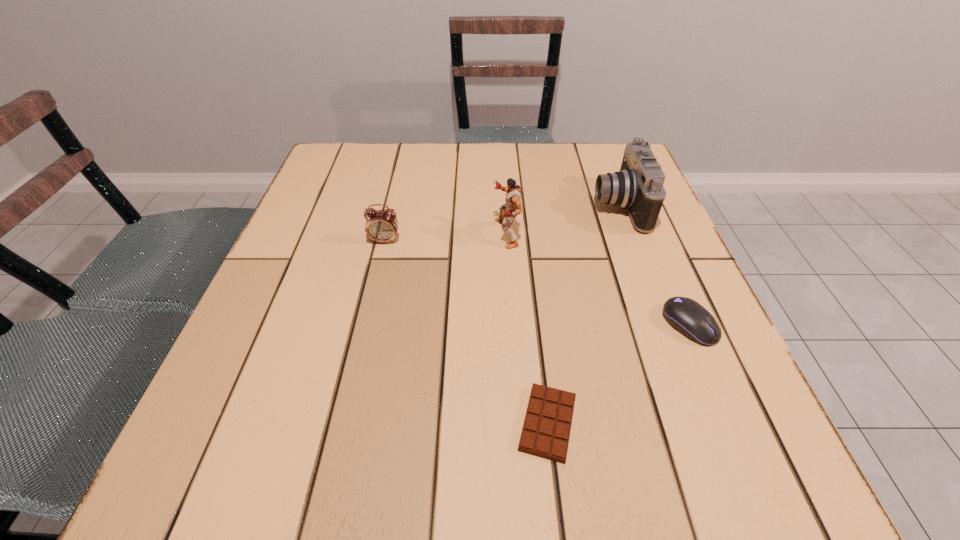
I want to click on puncher, so click(x=512, y=207).

Where is `camera`? Image resolution: width=960 pixels, height=540 pixels. camera is located at coordinates [638, 187].

Where is `alarm clock`? The height and width of the screenshot is (540, 960). alarm clock is located at coordinates (381, 225).

The image size is (960, 540). Find the location of `the third tallest object`. the third tallest object is located at coordinates click(381, 225).

You are a GUI agent. You are given a task and a screenshot of the screen. Output one action in this format:
    pyautogui.click(x=<x>, y=<y>)
    Task: Click on the fourth farthest object
    The height and width of the screenshot is (540, 960).
    Given the screenshot: What is the action you would take?
    pyautogui.click(x=688, y=317)

Locate an element on the screen. This screenshot has height=540, width=960. the second shortest object is located at coordinates (688, 317).

Locate an element on the screen. Image resolution: width=960 pixels, height=540 pixels. candy bar is located at coordinates (546, 430).

Where is `the nearest object`? the nearest object is located at coordinates (546, 430).

This screenshot has width=960, height=540. Find the location of `vacant area situated 0.190m on the front-facing side of the puncher`. vacant area situated 0.190m on the front-facing side of the puncher is located at coordinates (406, 233).

Locate an element on the screen. This screenshot has height=540, width=960. vacant space situated 0.280m on the front-facing side of the puncher is located at coordinates (365, 233).